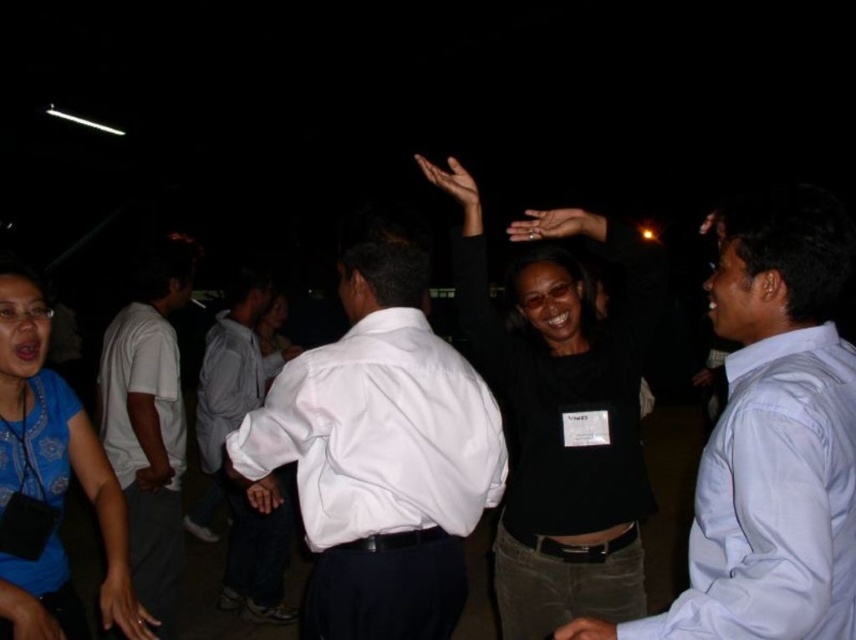
Question: Does brown matte hand at upper center lie behind smooth skin hand at center?

Choices:
 (A) no
 (B) yes

Answer: (B)

Question: Which of these objects is positioned closest to the black matte shirt at center?

Choices:
 (A) black matte hand at center
 (B) blue printed shirt at lower left
 (C) white smooth shirt at center

Answer: (C)

Question: Does light blue shirt at right appear over smooth skin hand at center?

Choices:
 (A) no
 (B) yes

Answer: (B)

Question: Among these points, which one is farthest from the camera?

Choices:
 (A) (135, 522)
 (B) (651, 292)
 (C) (462, 208)
 (D) (794, 221)

Answer: (C)

Question: Among these points, which one is farthest from the camera?

Choices:
 (A) (803, 493)
 (B) (562, 230)
 (C) (61, 449)

Answer: (B)

Question: Is blue printed shirt at lower left above brown matte hand at upper center?

Choices:
 (A) no
 (B) yes

Answer: (A)